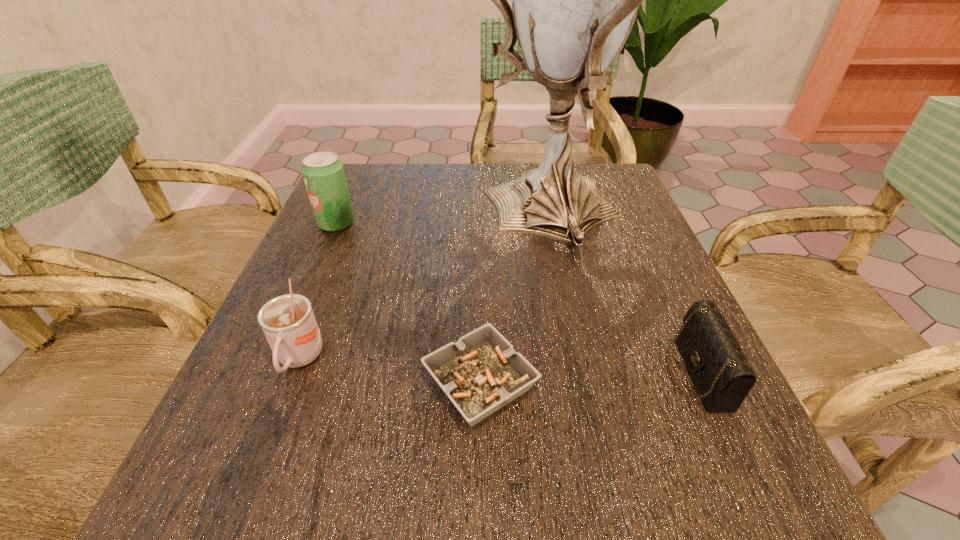
You are a GUI agent. You are given a task and a screenshot of the screen. Output one action in this format:
    pyautogui.click(x=<x>, y=<y>)
    Task: Click on the free space that satisfies the following two spatial constraints: 1. on the side with the handle of the shortest object; 2. on the left side of the cup
    The height and width of the screenshot is (540, 960).
    Given the screenshot: What is the action you would take?
    pyautogui.click(x=290, y=383)

Identify the location of vacant region that satisfies the following two spatial constraints: 1. on the side with the handle of the ashtray; 2. on the left side of the third tallest object. (290, 383).